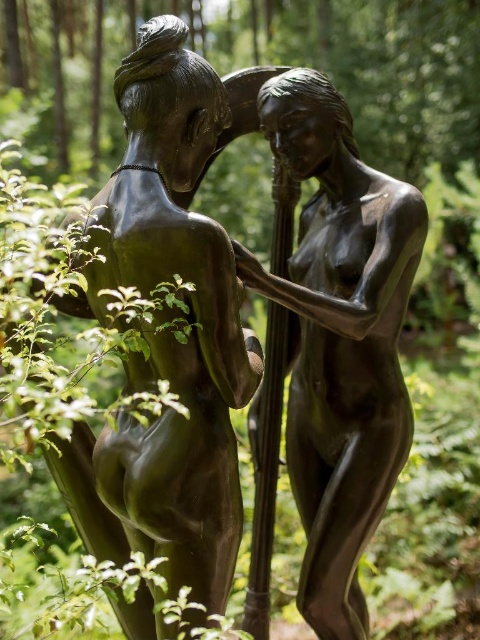
Question: Is bronze statue at center positioned behind shiny bronze statue at center?

Choices:
 (A) yes
 (B) no

Answer: (B)

Question: Which point appears farthest from the camera in this image?

Choices:
 (A) (140, 634)
 (B) (376, 442)

Answer: (B)

Question: Among these points, which one is farthest from the camera?

Choices:
 (A) (334, 328)
 (B) (178, 172)

Answer: (A)

Question: Is bronze statue at center thinner than shiny bronze statue at center?

Choices:
 (A) yes
 (B) no

Answer: (B)

Question: Which of the following is the farthest from the observer?

Choices:
 (A) (204, 244)
 (B) (325, 333)

Answer: (B)

Question: Observing the image, what is the correct spatial positioning of bronze statue at center in reference to shiny bronze statue at center?

Choices:
 (A) left
 (B) right

Answer: (A)